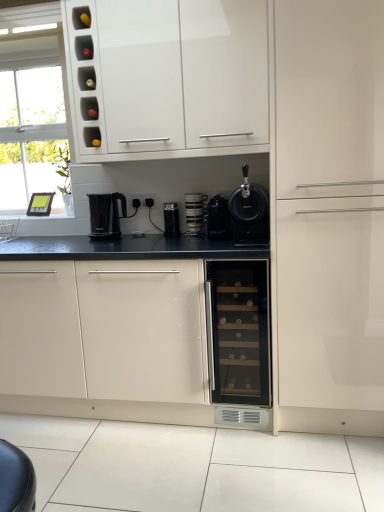
What do you see at coordinates (108, 325) in the screenshot? The image size is (384, 512). I see `glossy white wine cooler at center, the third cabinetry positioned from the right` at bounding box center [108, 325].

This screenshot has width=384, height=512. I want to click on black plastic electric outlet at center, so click(x=145, y=199).

This screenshot has height=512, width=384. What do you see at coordinates (145, 199) in the screenshot?
I see `black plastic electric outlet at center` at bounding box center [145, 199].

Locate an element on the screen. This screenshot has height=512, width=384. black plastic toaster at center, the second kitchen appliance from the left is located at coordinates (171, 219).

Find the location of `glossy white wine cooler at center, which is the 1th cabinetry in left-to-right order`. glossy white wine cooler at center, which is the 1th cabinetry in left-to-right order is located at coordinates (108, 325).

Is point (338, 359) farther from viewer compared to point (254, 266)?

No.

Identify the location of the 3rd cabinetry in front of the matte glass wine cooler at center. (329, 214).

In terms of width, does matte white cabinet at right, which ranks as the 1th cabinetry in right-to-left order, look wider or thinner when compared to matte glass wine cooler at center?

Considering their sizes, matte white cabinet at right, which ranks as the 1th cabinetry in right-to-left order, looks broader than matte glass wine cooler at center.

Can you confirm if matte white cabinet at right, marked as the third cabinetry in a left-to-right arrangement, is taller than matte glass wine cooler at center?

Indeed, matte white cabinet at right, marked as the third cabinetry in a left-to-right arrangement, has a greater height compared to matte glass wine cooler at center.

Is glossy white wine cooler at center, which is the 1th cabinetry in left-to-right order, looking in the opposite direction of black plastic electric outlet at center?

No, black plastic electric outlet at center is not at the back of glossy white wine cooler at center, which is the 1th cabinetry in left-to-right order.

Considering the points (92, 309) and (143, 196), which point is in front, point (92, 309) or point (143, 196)?

The point (92, 309) is in front.

Is glossy white wine cooler at center, which is the 1th cabinetry in left-to-right order, smaller than black plastic electric outlet at center?

Incorrect, glossy white wine cooler at center, which is the 1th cabinetry in left-to-right order, is not smaller in size than black plastic electric outlet at center.

You are a GUI agent. You are given a task and a screenshot of the screen. Output one action in this format:
    pyautogui.click(x=<x>, y=<y>)
    Task: Click on the electric outlet below the white glossy cabinet at upper center, which is the 2th cabinetry in left-to-right order (from the image's perspective)
    The image size is (384, 512).
    Given the screenshot: What is the action you would take?
    pyautogui.click(x=145, y=199)

Considering the relative sizes of black plastic electric outlet at center and white glossy cabinet at upper center, which is the 2th cabinetry in left-to-right order, in the image provided, is black plastic electric outlet at center shorter than white glossy cabinet at upper center, which is the 2th cabinetry in left-to-right order,?

Yes.

Is black plastic electric outlet at center wider or thinner than white glossy cabinet at upper center, which is the 2th cabinetry in left-to-right order?

black plastic electric outlet at center is thinner than white glossy cabinet at upper center, which is the 2th cabinetry in left-to-right order.

Could you tell me if black matte coffee machine at center, the first kitchen appliance when ordered from right to left, is turned towards matte white cabinet at right, which ranks as the 1th cabinetry in right-to-left order?

No, black matte coffee machine at center, the first kitchen appliance when ordered from right to left, is not facing towards matte white cabinet at right, which ranks as the 1th cabinetry in right-to-left order.

Looking at this image, is black matte coffee machine at center, the first kitchen appliance when ordered from right to left, in front of matte white cabinet at right, marked as the third cabinetry in a left-to-right arrangement?

No, black matte coffee machine at center, the first kitchen appliance when ordered from right to left, is behind matte white cabinet at right, marked as the third cabinetry in a left-to-right arrangement.

Find the location of a particular element. kitchen appliance that is the 2nd one when counting upward from the matte white cabinet at right, which ranks as the 1th cabinetry in right-to-left order (from the image's perspective) is located at coordinates (249, 212).

Would you say black matte coffee machine at center, which is the fourth kitchen appliance in left-to-right order, is a long distance from matte white cabinet at right, which ranks as the 1th cabinetry in right-to-left order?

No, black matte coffee machine at center, which is the fourth kitchen appliance in left-to-right order, is not far away from matte white cabinet at right, which ranks as the 1th cabinetry in right-to-left order.

Which object is wider, matte white cabinet at right, marked as the third cabinetry in a left-to-right arrangement, or black matte coffee machine at center, the first kitchen appliance when ordered from right to left?

matte white cabinet at right, marked as the third cabinetry in a left-to-right arrangement.

Looking at this image, is matte white cabinet at right, marked as the third cabinetry in a left-to-right arrangement, touching black matte coffee machine at center, the first kitchen appliance when ordered from right to left?

There is a gap between matte white cabinet at right, marked as the third cabinetry in a left-to-right arrangement, and black matte coffee machine at center, the first kitchen appliance when ordered from right to left.

Considering the positions of objects matte white cabinet at right, marked as the third cabinetry in a left-to-right arrangement, and black matte coffee machine at center, which is the fourth kitchen appliance in left-to-right order, in the image provided, who is behind, matte white cabinet at right, marked as the third cabinetry in a left-to-right arrangement, or black matte coffee machine at center, which is the fourth kitchen appliance in left-to-right order,?

black matte coffee machine at center, which is the fourth kitchen appliance in left-to-right order, is more distant.

From the image's perspective, would you say matte glass wine cooler at center is shown under stacked white mugs at center, which is the third kitchen appliance in left-to-right order?

Yes.

Which is less distant, (x=232, y=393) or (x=198, y=204)?

Point (x=232, y=393).

Does matte glass wine cooler at center turn towards stacked white mugs at center, which ranks as the 2th kitchen appliance in right-to-left order?

No, matte glass wine cooler at center does not turn towards stacked white mugs at center, which ranks as the 2th kitchen appliance in right-to-left order.

Which object is positioned more to the right, black plastic kettle at center, placed as the fourth kitchen appliance when sorted from right to left, or black plastic electric outlet at center?

Positioned to the right is black plastic electric outlet at center.

Does black plastic kettle at center, the first kitchen appliance viewed from the left, touch black plastic electric outlet at center?

They are not placed beside each other.

Consider the image. From the image's perspective, is black plastic kettle at center, placed as the fourth kitchen appliance when sorted from right to left, above or below black plastic electric outlet at center?

black plastic kettle at center, placed as the fourth kitchen appliance when sorted from right to left, is situated lower than black plastic electric outlet at center in the image.

You are a GUI agent. You are given a task and a screenshot of the screen. Output one action in this format:
    pyautogui.click(x=<x>, y=<y>)
    Task: Click on the cabinetry on the right side of matte glass wine cooler at center
    The width and height of the screenshot is (384, 512).
    Given the screenshot: What is the action you would take?
    tap(329, 214)

The image size is (384, 512). Find the location of `electric outlet that appears above the glossy white wine cooler at center, which is the 1th cabinetry in left-to-right order (from a real-world perspective)`. electric outlet that appears above the glossy white wine cooler at center, which is the 1th cabinetry in left-to-right order (from a real-world perspective) is located at coordinates (145, 199).

Looking at the image, which one is located closer to matte white cabinet at right, marked as the third cabinetry in a left-to-right arrangement, black plastic kettle at center, the first kitchen appliance viewed from the left, or black matte coffee machine at center, which is the fourth kitchen appliance in left-to-right order?

black matte coffee machine at center, which is the fourth kitchen appliance in left-to-right order, lies closer to matte white cabinet at right, marked as the third cabinetry in a left-to-right arrangement, than the other object.

From the image, which object appears to be farther from black matte coffee machine at center, which is the fourth kitchen appliance in left-to-right order, matte white cabinet at right, which ranks as the 1th cabinetry in right-to-left order, or black plastic toaster at center, placed as the third kitchen appliance when sorted from right to left?

Based on the image, black plastic toaster at center, placed as the third kitchen appliance when sorted from right to left, appears to be further to black matte coffee machine at center, which is the fourth kitchen appliance in left-to-right order.

Which object lies further to the anchor point black plastic kettle at center, placed as the fourth kitchen appliance when sorted from right to left, white glossy cabinet at upper center, which is the 2th cabinetry in left-to-right order, or black plastic electric outlet at center?

white glossy cabinet at upper center, which is the 2th cabinetry in left-to-right order, is positioned further to the anchor black plastic kettle at center, placed as the fourth kitchen appliance when sorted from right to left.

Looking at the image, which one is located further to black plastic toaster at center, placed as the third kitchen appliance when sorted from right to left, black plastic kettle at center, placed as the fourth kitchen appliance when sorted from right to left, or white glossy cabinet at upper center, the second cabinetry positioned from the right?

The object further to black plastic toaster at center, placed as the third kitchen appliance when sorted from right to left, is white glossy cabinet at upper center, the second cabinetry positioned from the right.

Looking at the image, which one is located closer to stacked white mugs at center, which is the third kitchen appliance in left-to-right order, matte white cabinet at right, marked as the third cabinetry in a left-to-right arrangement, or matte glass wine cooler at center?

Among the two, matte glass wine cooler at center is located nearer to stacked white mugs at center, which is the third kitchen appliance in left-to-right order.

Considering their positions, is black plastic electric outlet at center positioned further to matte white cabinet at right, which ranks as the 1th cabinetry in right-to-left order, than black plastic kettle at center, placed as the fourth kitchen appliance when sorted from right to left?

black plastic kettle at center, placed as the fourth kitchen appliance when sorted from right to left, is further to matte white cabinet at right, which ranks as the 1th cabinetry in right-to-left order.

Based on their spatial positions, is black plastic kettle at center, the first kitchen appliance viewed from the left, or black matte coffee machine at center further from black plastic electric outlet at center?

The object further to black plastic electric outlet at center is black matte coffee machine at center.

In the scene shown: Based on their spatial positions, is glossy white wine cooler at center, the third cabinetry positioned from the right, or matte glass wine cooler at center further from stacked white mugs at center, which ranks as the 2th kitchen appliance in right-to-left order?

glossy white wine cooler at center, the third cabinetry positioned from the right, lies further to stacked white mugs at center, which ranks as the 2th kitchen appliance in right-to-left order, than the other object.

Identify the location of electric outlet between white glossy cabinet at upper center, the second cabinetry positioned from the right, and black plastic toaster at center, the second kitchen appliance from the left, in the up-down direction. (145, 199).

In order to click on cabinetry between white glossy cabinet at upper center, which is the 2th cabinetry in left-to-right order, and glossy white wine cooler at center, the third cabinetry positioned from the right, vertically in this screenshot , I will do `click(329, 214)`.

Identify the location of electric outlet that lies between white glossy cabinet at upper center, which is the 2th cabinetry in left-to-right order, and black plastic kettle at center, placed as the fourth kitchen appliance when sorted from right to left, from top to bottom. This screenshot has height=512, width=384. (145, 199).

The width and height of the screenshot is (384, 512). Find the location of `kitchen appliance between white glossy cabinet at upper center, the second cabinetry positioned from the right, and stacked white mugs at center, which ranks as the 2th kitchen appliance in right-to-left order, in the vertical direction`. kitchen appliance between white glossy cabinet at upper center, the second cabinetry positioned from the right, and stacked white mugs at center, which ranks as the 2th kitchen appliance in right-to-left order, in the vertical direction is located at coordinates (249, 212).